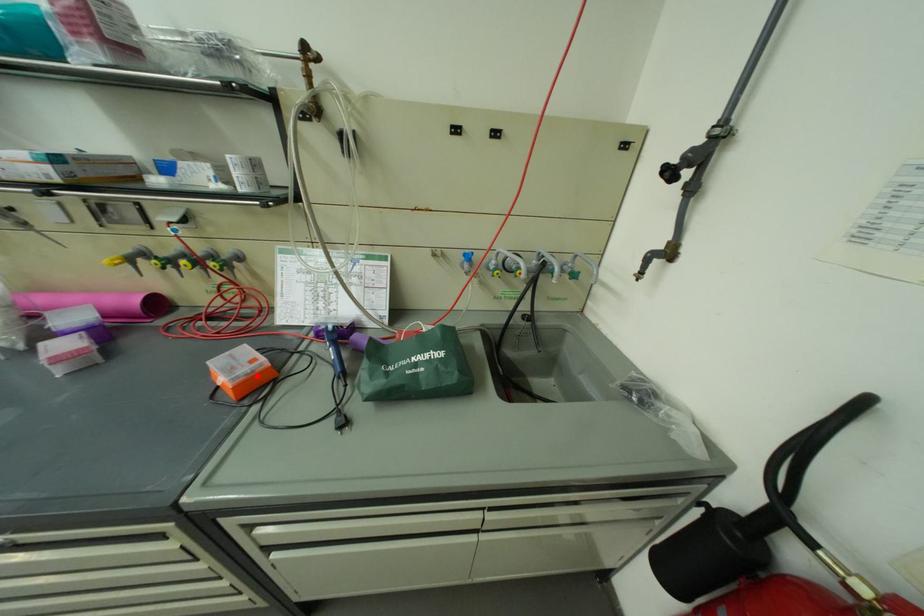
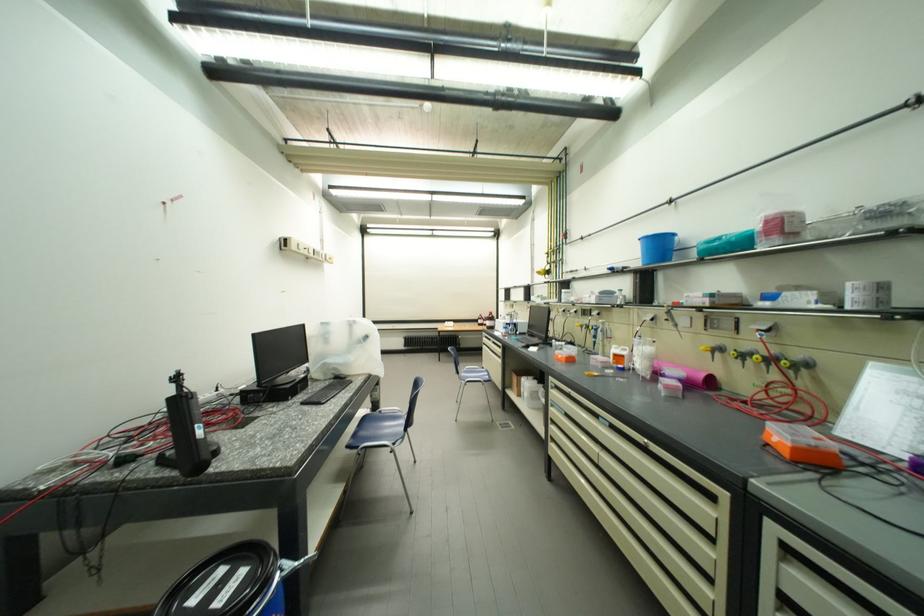
Where in the second image is the point corresponding to the highlighted location from the first image?

(820, 447)